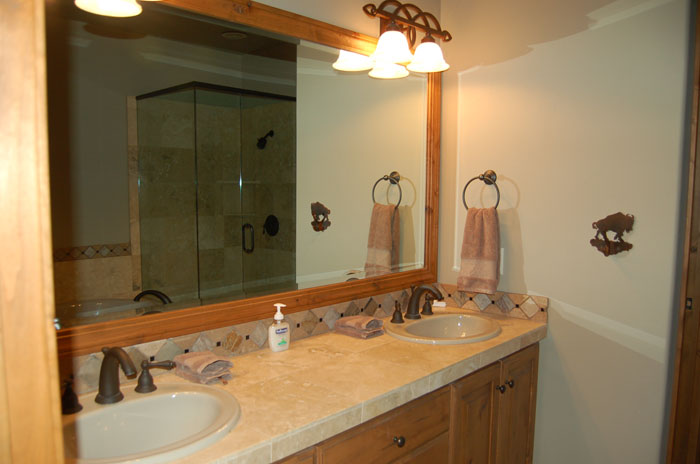
The height and width of the screenshot is (464, 700). In order to click on glass shower in reflection in this screenshot , I will do `click(176, 229)`.